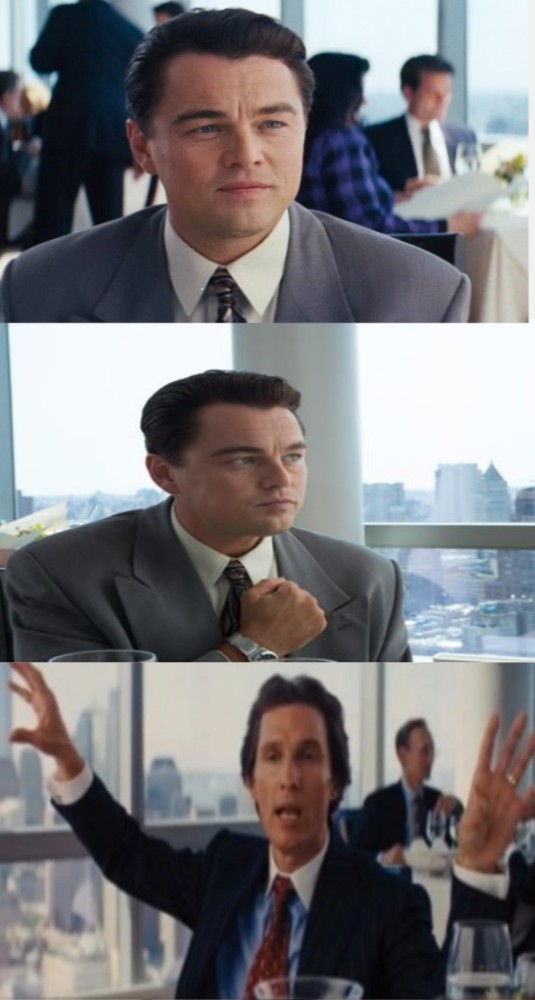
This screenshot has height=1000, width=535. Identify the location of glass. (472, 957).